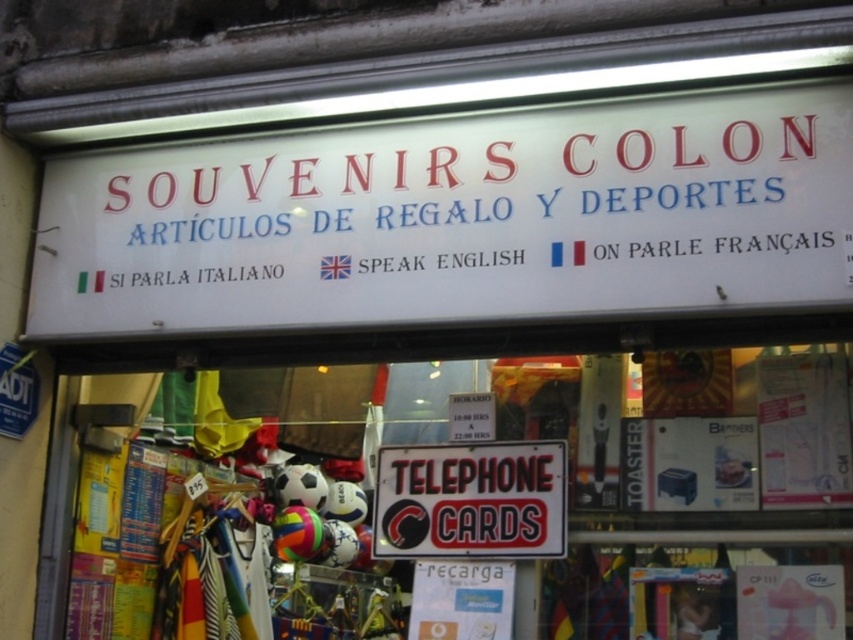
Question: Does white plastic sign at upper center have a larger size compared to white plastic telephone cards at center?

Choices:
 (A) yes
 (B) no

Answer: (A)

Question: Considering the relative positions of white plastic sign at upper center and white plastic telephone cards at center in the image provided, where is white plastic sign at upper center located with respect to white plastic telephone cards at center?

Choices:
 (A) below
 (B) above

Answer: (B)

Question: Which of these objects is positioned closest to the black plastic telephone cards at center?

Choices:
 (A) white plastic telephone cards at center
 (B) white plastic sign at upper center

Answer: (A)

Question: Which object is the closest to the white plastic sign at upper center?

Choices:
 (A) white plastic telephone cards at center
 (B) black plastic telephone cards at center

Answer: (A)

Question: Can you confirm if white plastic sign at upper center is positioned below black plastic telephone cards at center?

Choices:
 (A) no
 (B) yes

Answer: (A)

Question: Which point appears closest to the camera in this image?

Choices:
 (A) (728, 512)
 (B) (432, 547)

Answer: (A)